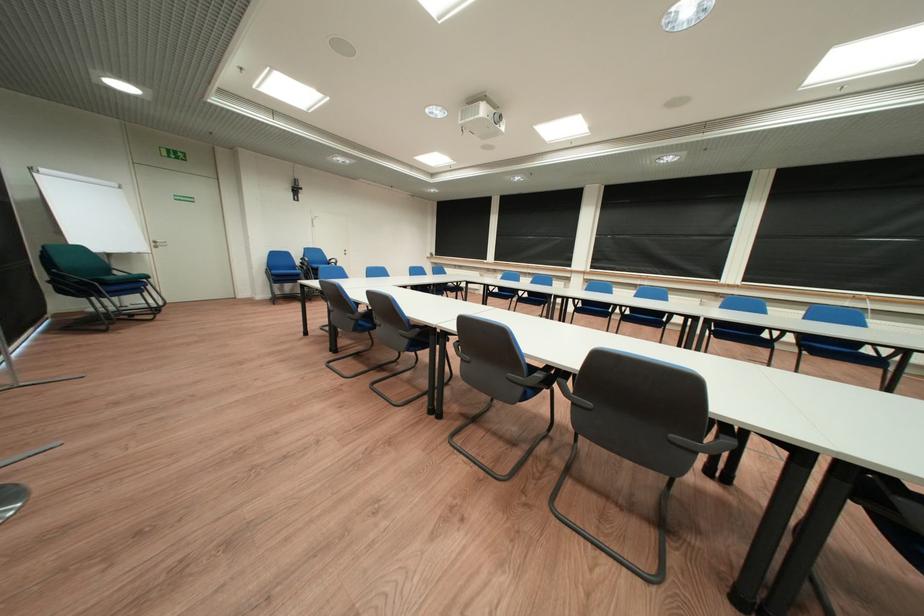
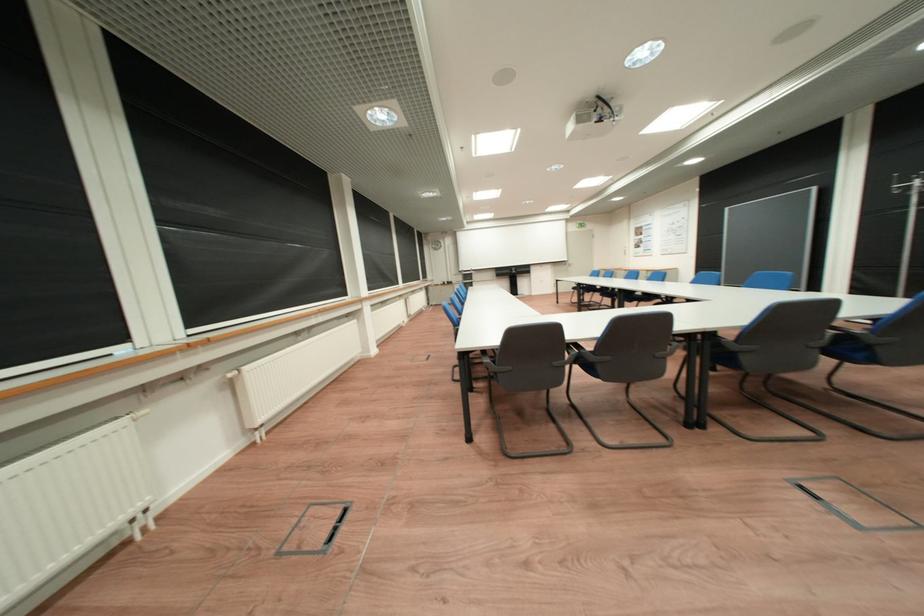
Question: I am providing you with two images of the same scene from different viewpoints. Which of the following objects are not visible in image2?

Choices:
 (A) blue chair sitting surface
 (B) blue metal handle
 (C) blue chair armrest
 (D) floor box handle

Answer: (A)